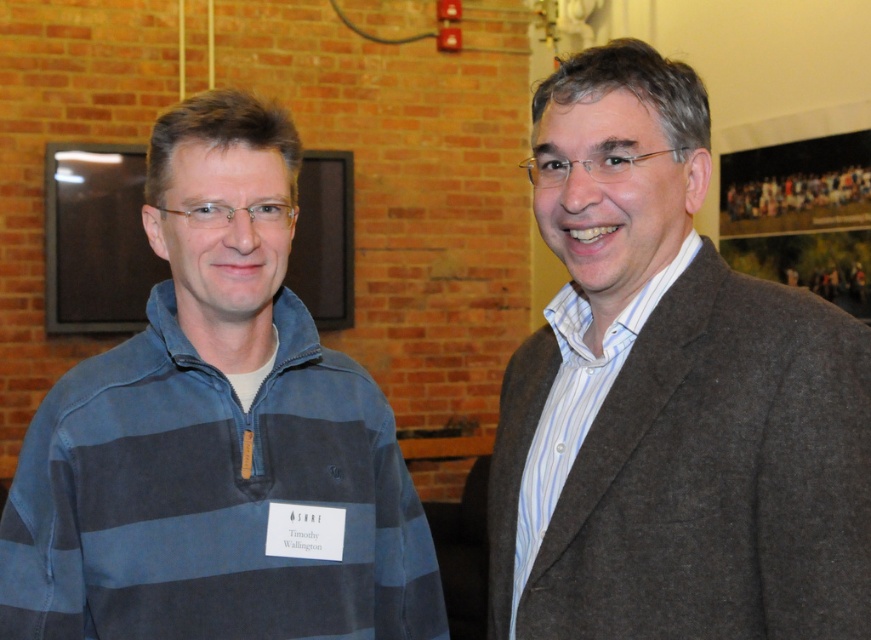
You are an event planner setting up a photo backdrop. You need to position a spotlight that can illuminate both the gray woolen blazer at right and the matte black monitor at upper left. Based on their positions, which object should the spotlight be placed closer to?

The spotlight should be placed closer to the matte black monitor at upper left because the gray woolen blazer at right is to the right of it, meaning the monitor is positioned further to the left and would require the light to cover both areas effectively.

Consider the image. You are a photographer standing at point (213, 460). You want to take a photo of both individuals so that they are both in focus. The camera you are using has a depth of field that can cover 1.5 meters. Will you be able to capture both individuals in focus?

The two individuals are 1.37 meters apart, which is within the camera depth of field of 1.5 meters. Therefore, both individuals can be captured in focus.